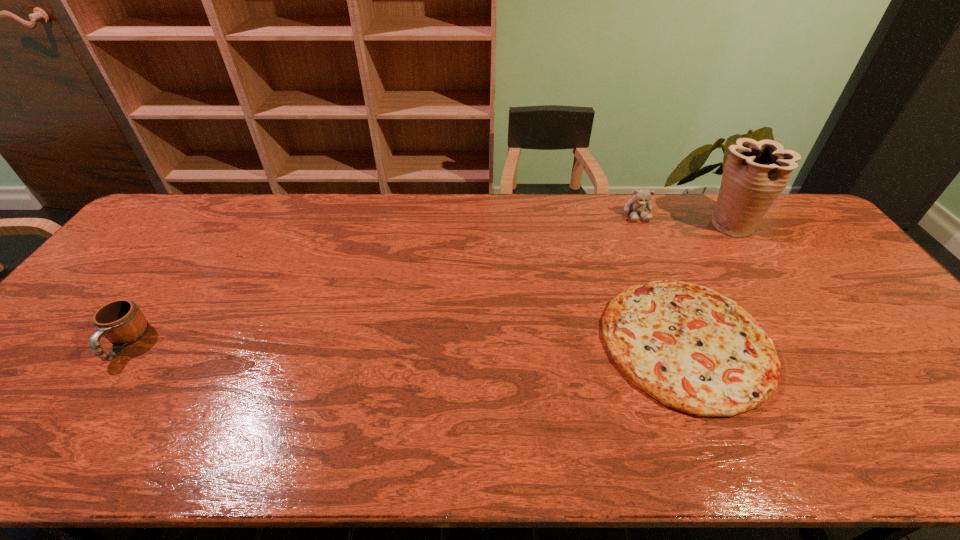
Identify the location of the rightmost object. The width and height of the screenshot is (960, 540). (755, 174).

Find the location of a particular element. This screenshot has width=960, height=540. urn is located at coordinates [x=755, y=174].

Where is `teddy bear`? Image resolution: width=960 pixels, height=540 pixels. teddy bear is located at coordinates (641, 198).

Find the location of a particular element. This screenshot has height=540, width=960. mug is located at coordinates (122, 322).

In order to click on the second shortest object in this screenshot , I will do `click(122, 322)`.

The image size is (960, 540). I want to click on the shortest object, so click(x=691, y=348).

Locate an element on the screen. vacant space located 0.220m on the front of the rightmost object is located at coordinates (776, 292).

Where is `vacant area located on the face of the teddy bear`? Image resolution: width=960 pixels, height=540 pixels. vacant area located on the face of the teddy bear is located at coordinates (660, 269).

Where is `free spot located 0.070m on the side of the third tallest object with the handle`? This screenshot has height=540, width=960. free spot located 0.070m on the side of the third tallest object with the handle is located at coordinates (90, 393).

At what (x,y) coordinates should I click in order to perform the action: click on free space located 0.080m on the back of the pizza. Please return your answer as a coordinate pair (x, y). The image size is (960, 540). Looking at the image, I should click on (654, 265).